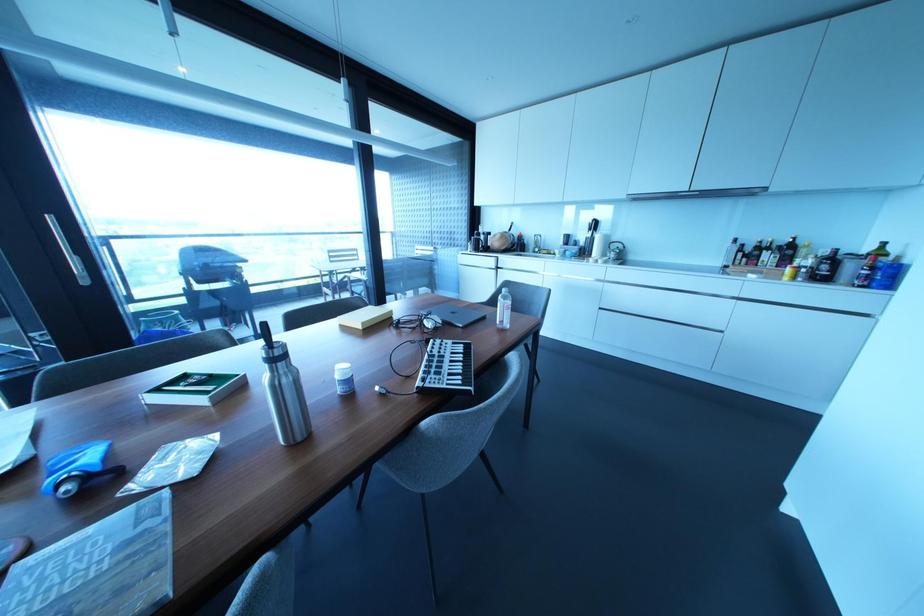
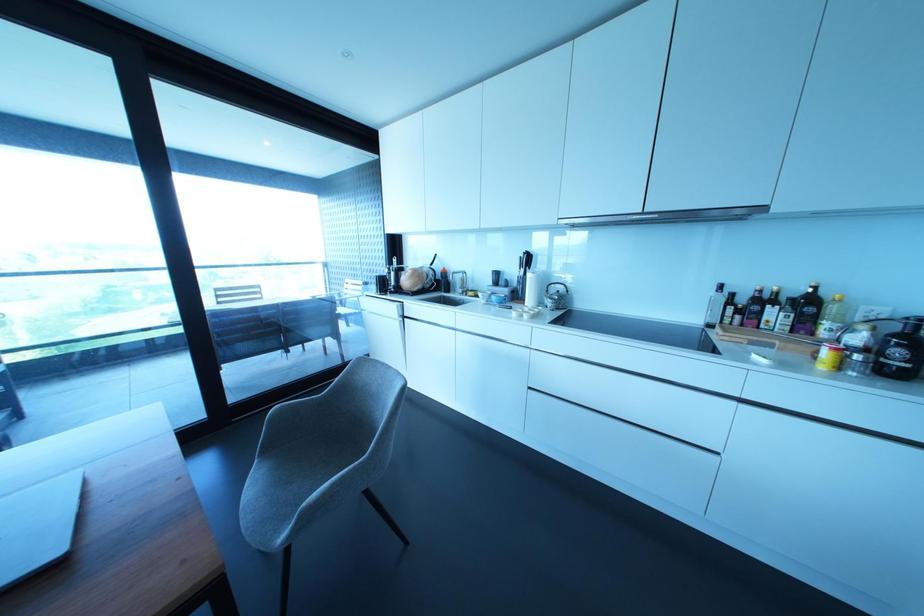
Find the pixel in the second image that matches pixel 593 225 in the first image.

(527, 259)